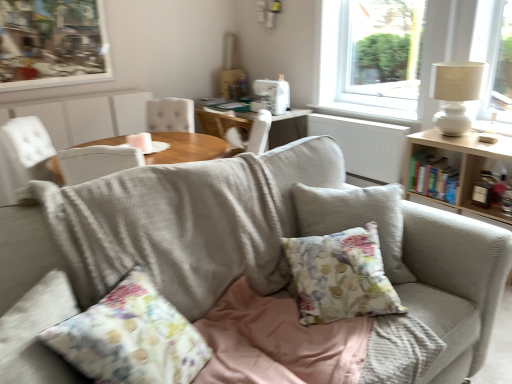
Question: In the image, is white ceramic table lamp at upper right positioned in front of or behind wooden table at right?

Choices:
 (A) front
 (B) behind

Answer: (B)

Question: From a real-world perspective, is white ceramic table lamp at upper right positioned above or below wooden table at right?

Choices:
 (A) above
 (B) below

Answer: (A)

Question: Which object is the farthest from the white painted wood at upper right?

Choices:
 (A) white fabric chair at center
 (B) wooden table at right
 (C) floral fabric cushion at center
 (D) textured fabric couch at center
 (E) wooden picture frame at upper left

Answer: (E)

Question: Estimate the real-world distances between objects in this image. Which object is closer to the white painted wood at upper right?

Choices:
 (A) white fabric chair at center
 (B) floral fabric cushion at center
 (C) wooden picture frame at upper left
 (D) white ceramic table lamp at upper right
 (E) white textured radiator at center

Answer: (E)